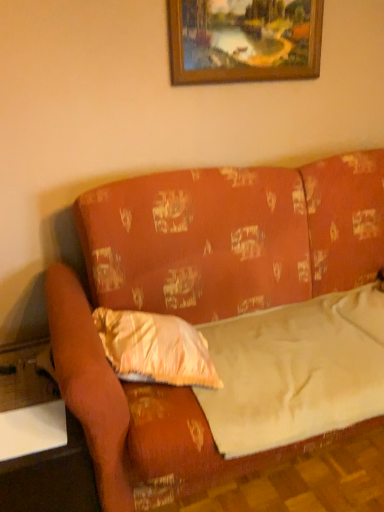
Locate an element on the screen. The height and width of the screenshot is (512, 384). free space above white plastic table at lower left, which is counted as the first table, starting from the top (from a real-world perspective) is located at coordinates [28, 426].